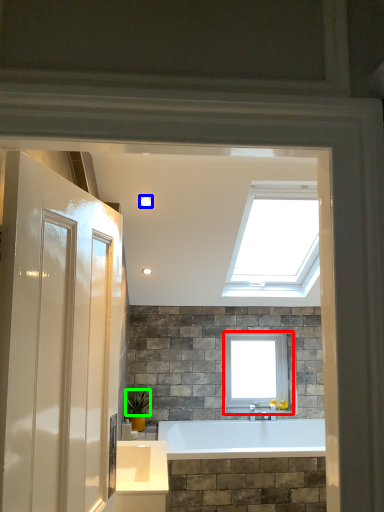
Question: Considering the real-world distances, which object is farthest from window (highlighted by a red box)? lighting (highlighted by a blue box) or plant (highlighted by a green box)?

Choices:
 (A) lighting
 (B) plant

Answer: (A)